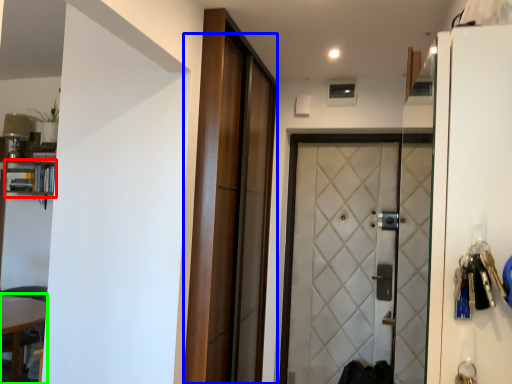
Question: Which object is positioned closest to bookshelf (highlighted by a red box)? Select from door (highlighted by a blue box) and table (highlighted by a green box).

Choices:
 (A) door
 (B) table

Answer: (B)